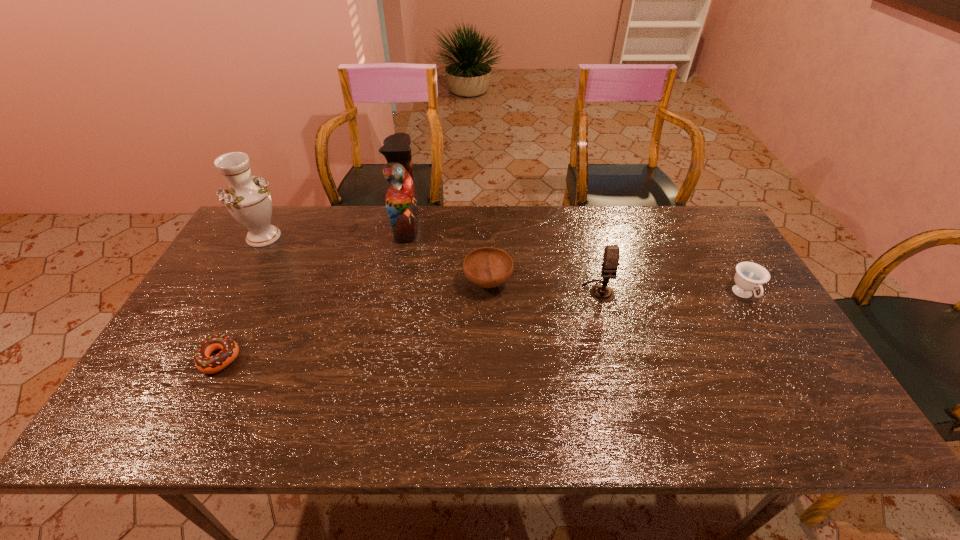
Where is `parrot`? This screenshot has height=540, width=960. parrot is located at coordinates (401, 201).

At what (x,y) coordinates should I click in order to perform the action: click on vase. Please return your answer as a coordinate pair (x, y). Looking at the image, I should click on pyautogui.click(x=247, y=198).

Locate an element on the screen. Image resolution: width=960 pixels, height=540 pixels. the fourth shortest object is located at coordinates (601, 292).

Where is `microphone`? This screenshot has width=960, height=540. microphone is located at coordinates (601, 292).

You are a GUI agent. You are given a task and a screenshot of the screen. Output one action in this format:
    pyautogui.click(x=<x>, y=<y>)
    Task: Click on the rightmost object
    The width and height of the screenshot is (960, 540).
    Given the screenshot: What is the action you would take?
    pyautogui.click(x=749, y=276)

At what (x,y) coordinates should I click in order to perform the action: click on the third object from right to left. Please return your answer as a coordinate pair (x, y). This screenshot has width=960, height=540. Looking at the image, I should click on (488, 267).

Locate an element on the screen. the nearest object is located at coordinates (204, 363).

Identify the location of the shortest object. This screenshot has height=540, width=960. (204, 363).

Find the location of `vacant space located 0.070m at the face of the parrot`. vacant space located 0.070m at the face of the parrot is located at coordinates (441, 225).

Where is `vacant space located on the right of the vase`? Image resolution: width=960 pixels, height=540 pixels. vacant space located on the right of the vase is located at coordinates (401, 237).